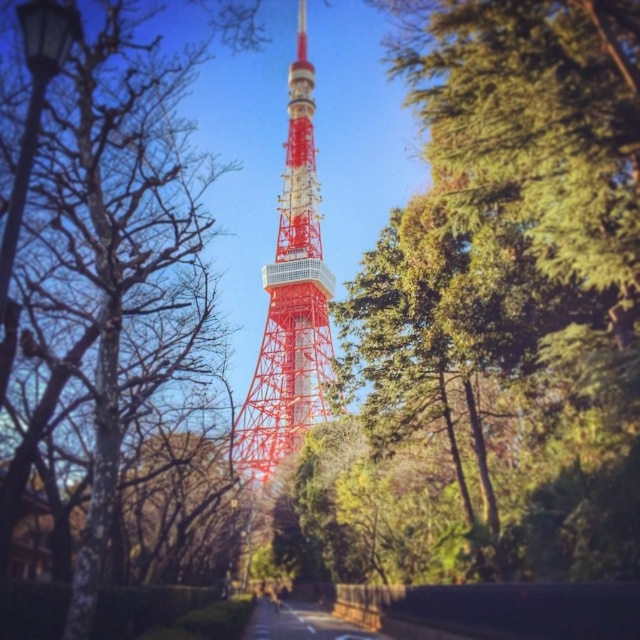
Question: Which of the following is the farthest from the observer?

Choices:
 (A) (288, 369)
 (B) (113, 33)

Answer: (A)

Question: Does red painted metal tower at center have a smaller size compared to bare wood tree at left?

Choices:
 (A) yes
 (B) no

Answer: (A)

Question: Can you confirm if red painted metal tower at center is smaller than bare wood tree at left?

Choices:
 (A) yes
 (B) no

Answer: (A)

Question: Can you confirm if red painted metal tower at center is thinner than bare wood tree at left?

Choices:
 (A) no
 (B) yes

Answer: (B)

Question: Among these objects, which one is farthest from the camera?

Choices:
 (A) bare wood tree at left
 (B) red painted metal tower at center

Answer: (B)

Question: Among these points, which one is nearest to the camera?

Choices:
 (A) (292, 291)
 (B) (115, 24)

Answer: (B)